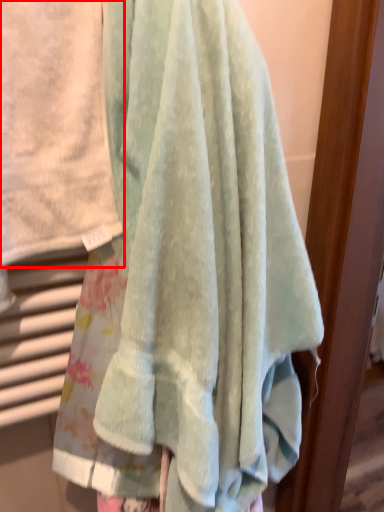
Question: In this image, where is towel (annotated by the red box) located relative to towel?

Choices:
 (A) right
 (B) left

Answer: (B)